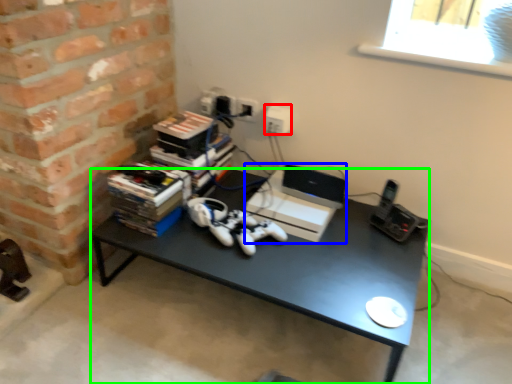
Question: Which is nearer to the electric outlet (highlighted by a red box)? computer (highlighted by a blue box) or desk (highlighted by a green box).

Choices:
 (A) computer
 (B) desk

Answer: (A)